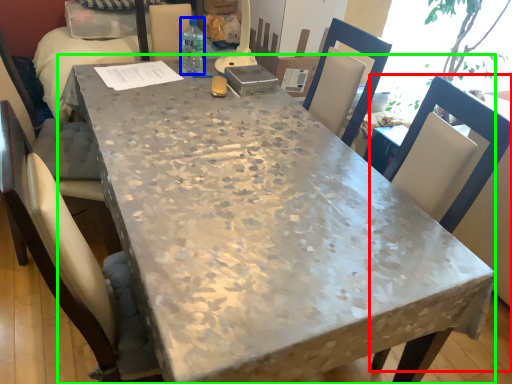
Question: Which object is the farthest from chair (highlighted by a red box)? Choose among these: bottle (highlighted by a blue box) or table (highlighted by a green box).

Choices:
 (A) bottle
 (B) table

Answer: (A)